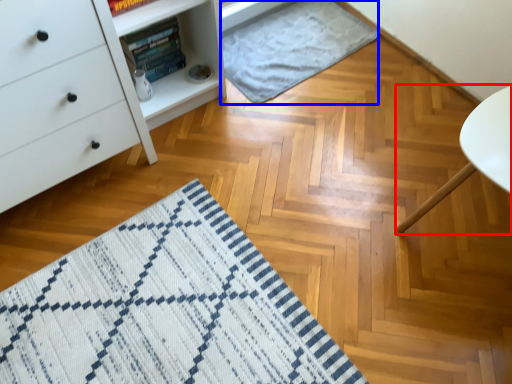
Question: Which object is closer to the camera taking this photo, furniture (highlighted by a red box) or blanket (highlighted by a blue box)?

Choices:
 (A) furniture
 (B) blanket

Answer: (A)